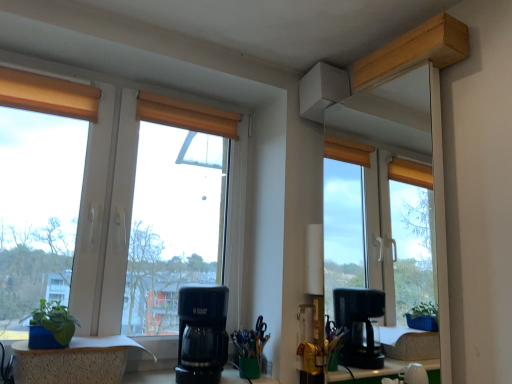
Question: Considering the relative sizes of green felt houseplant at lower left and blue textured planter at lower left, the second window positioned from the top, in the image provided, is green felt houseplant at lower left thinner than blue textured planter at lower left, the second window positioned from the top,?

Choices:
 (A) yes
 (B) no

Answer: (A)

Question: Considering the relative sizes of green felt houseplant at lower left and blue textured planter at lower left, the first window in the bottom-to-top sequence, in the image provided, is green felt houseplant at lower left shorter than blue textured planter at lower left, the first window in the bottom-to-top sequence,?

Choices:
 (A) no
 (B) yes

Answer: (B)

Question: From the image's perspective, is green felt houseplant at lower left located beneath blue textured planter at lower left, the second window positioned from the top?

Choices:
 (A) yes
 (B) no

Answer: (B)

Question: Considering the relative sizes of green felt houseplant at lower left and blue textured planter at lower left, the first window in the bottom-to-top sequence, in the image provided, is green felt houseplant at lower left smaller than blue textured planter at lower left, the first window in the bottom-to-top sequence,?

Choices:
 (A) yes
 (B) no

Answer: (A)

Question: Does green felt houseplant at lower left appear on the right side of blue textured planter at lower left, the second window positioned from the top?

Choices:
 (A) no
 (B) yes

Answer: (A)

Question: From their relative heights in the image, would you say black plastic coffee maker at center is taller or shorter than matte glass window at left, the second window ordered from the bottom?

Choices:
 (A) short
 (B) tall

Answer: (A)

Question: From a real-world perspective, is black plastic coffee maker at center above or below matte glass window at left, the second window ordered from the bottom?

Choices:
 (A) below
 (B) above

Answer: (A)

Question: In the image, is black plastic coffee maker at center positioned in front of or behind matte glass window at left, which is counted as the first window, starting from the top?

Choices:
 (A) behind
 (B) front

Answer: (A)

Question: Is point (221, 297) positioned closer to the camera than point (58, 79)?

Choices:
 (A) closer
 (B) farther

Answer: (A)

Question: Looking at their shapes, would you say wooden blind at center is wider or thinner than matte glass window at left, which is counted as the first window, starting from the top?

Choices:
 (A) thin
 (B) wide

Answer: (B)

Question: Considering the positions of wooden blind at center and matte glass window at left, the second window ordered from the bottom, in the image, is wooden blind at center taller or shorter than matte glass window at left, the second window ordered from the bottom,?

Choices:
 (A) tall
 (B) short

Answer: (B)

Question: In the image, is wooden blind at center on the left side or the right side of matte glass window at left, which is counted as the first window, starting from the top?

Choices:
 (A) left
 (B) right

Answer: (B)

Question: Which is correct: wooden blind at center is inside matte glass window at left, which is counted as the first window, starting from the top, or outside of it?

Choices:
 (A) inside
 (B) outside

Answer: (A)

Question: Considering the positions of point (217, 316) and point (98, 345), is point (217, 316) closer or farther from the camera than point (98, 345)?

Choices:
 (A) closer
 (B) farther

Answer: (B)

Question: Which is correct: black plastic coffee maker at center is inside blue textured planter at lower left, the first window in the bottom-to-top sequence, or outside of it?

Choices:
 (A) inside
 (B) outside

Answer: (B)